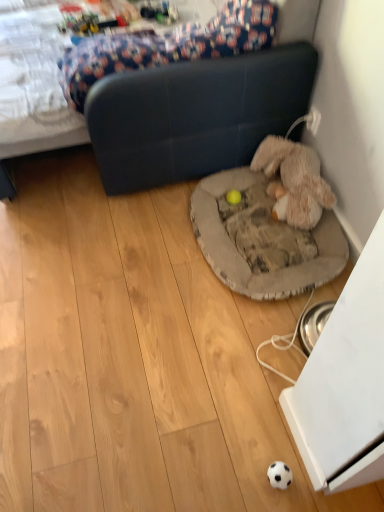
Question: Is point (294, 8) closer or farther from the camera than point (233, 197)?

Choices:
 (A) farther
 (B) closer

Answer: (B)

Question: From a real-world perspective, is dark blue leather studio couch at center positioned above or below yellow rubber ball at center, marked as the 2th toy in a right-to-left arrangement?

Choices:
 (A) above
 (B) below

Answer: (A)

Question: Which object is positioned closest to the gray fabric dog bed at center?

Choices:
 (A) floral fabric mattress at upper left
 (B) dark blue leather studio couch at center
 (C) fuzzy beige stuffed animal at lower right, the 2th toy from the left
 (D) yellow rubber ball at center, marked as the 2th toy in a right-to-left arrangement

Answer: (C)

Question: Estimate the real-world distances between objects in this image. Which object is farther from the floral fabric mattress at upper left?

Choices:
 (A) yellow rubber ball at center, which ranks as the 1th toy in left-to-right order
 (B) fuzzy beige stuffed animal at lower right, which ranks as the 1th toy in right-to-left order
 (C) dark blue leather studio couch at center
 (D) gray fabric dog bed at center

Answer: (A)